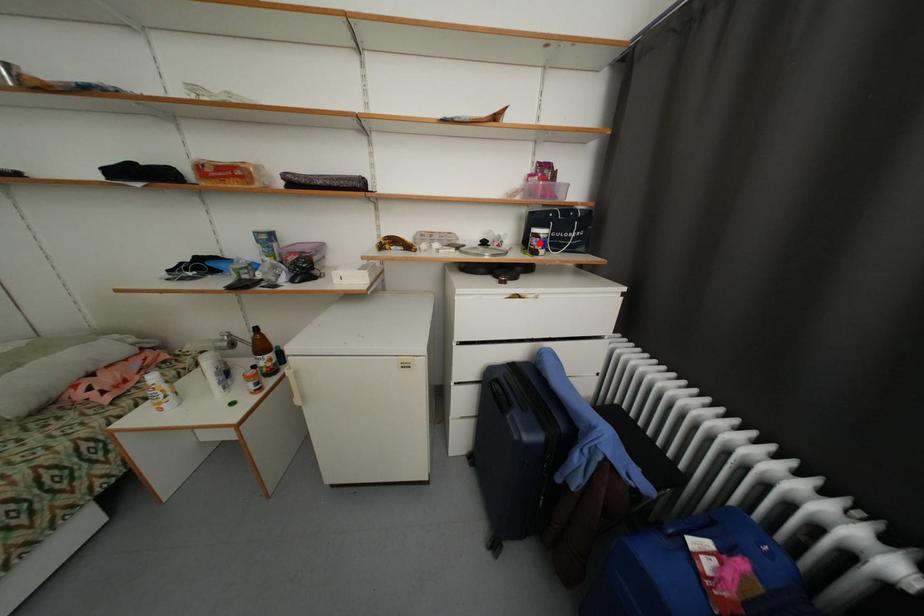
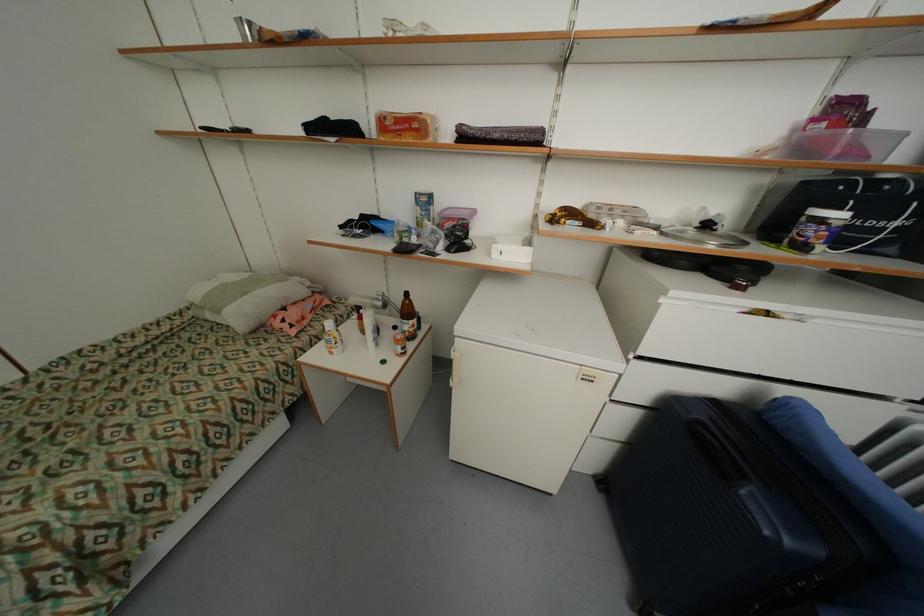
Question: I am providing you with two images of the same scene from different viewpoints. Image1 has a red point marked. In image2, the corresponding 3D location appears at what relative position? Reply with the corresponding letter.

Choices:
 (A) Closer
 (B) Farther

Answer: (B)